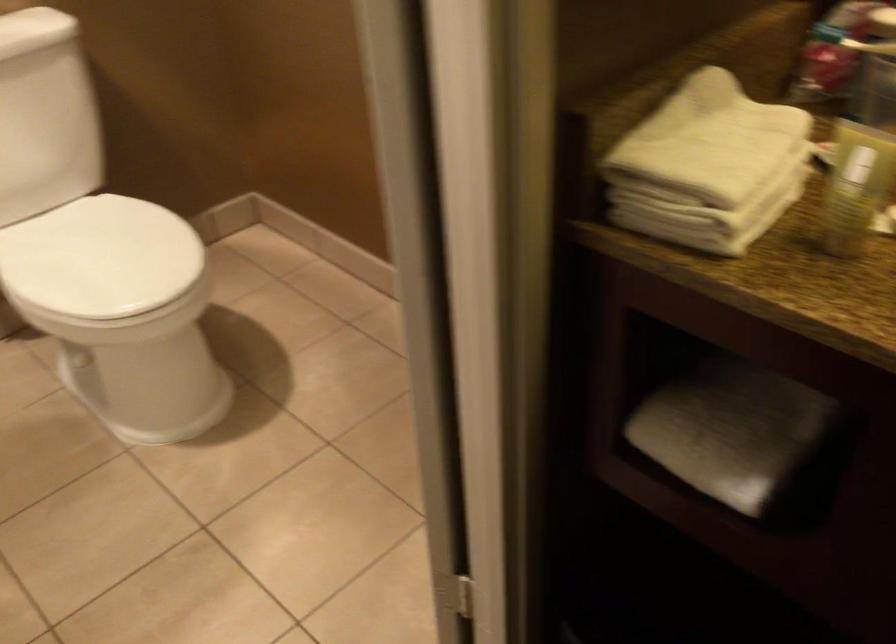
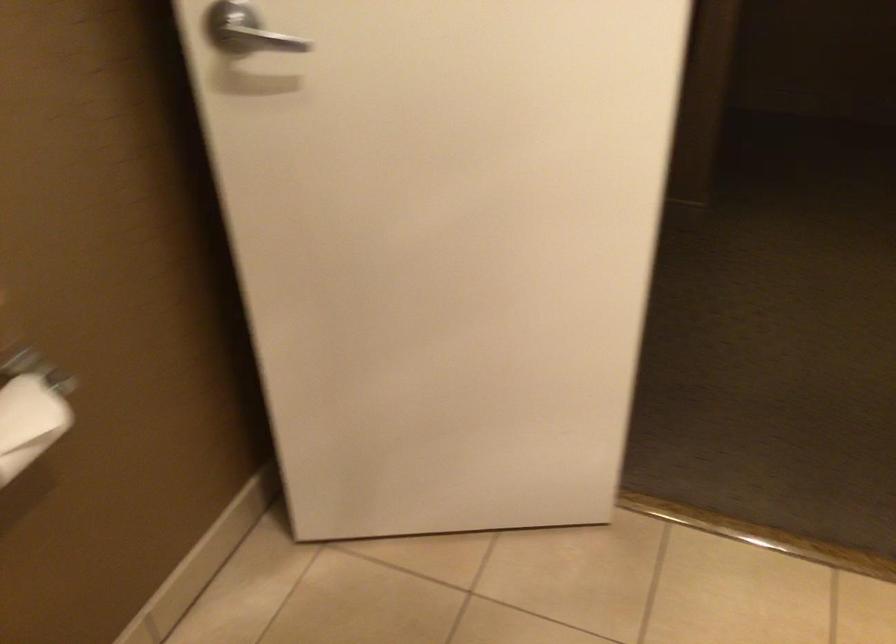
Question: I am providing you with two images of the same scene from different viewpoints. Which of the following objects are not visible in image2?

Choices:
 (A) white printer cover
 (B) silver door handle
 (C) toilet paper roll
 (D) rolled white towel

Answer: (D)